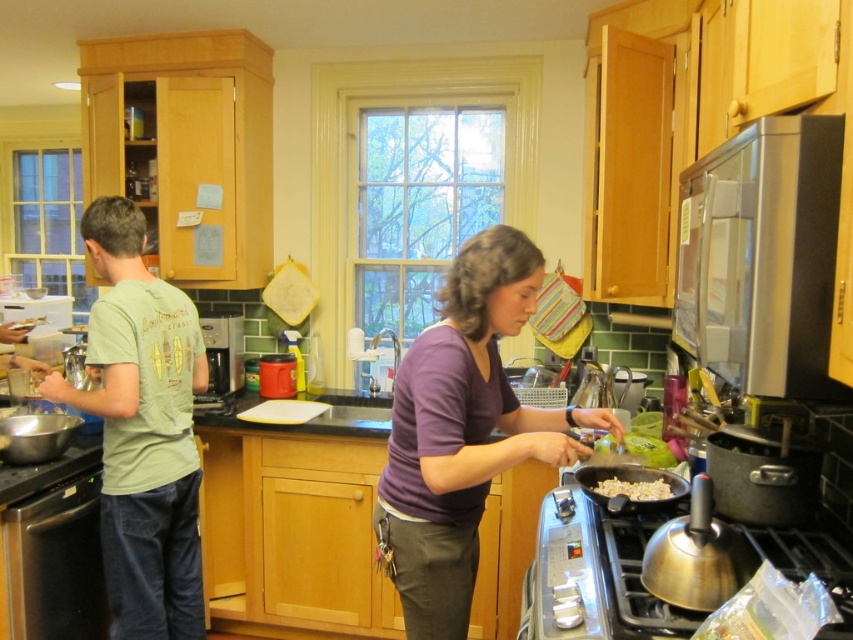
Does satin black dishwasher at lower left have a lesser width compared to brown matte pan at lower center?

Yes, satin black dishwasher at lower left is thinner than brown matte pan at lower center.

Does satin black dishwasher at lower left have a lesser height compared to brown matte pan at lower center?

In fact, satin black dishwasher at lower left may be taller than brown matte pan at lower center.

Does point (16, 621) come in front of point (627, 481)?

No, (16, 621) is further to viewer.

Locate an element on the screen. The image size is (853, 640). satin black dishwasher at lower left is located at coordinates (56, 563).

This screenshot has height=640, width=853. What do you see at coordinates (142, 429) in the screenshot?
I see `green cotton shirt at left` at bounding box center [142, 429].

Which is more to the right, green cotton shirt at left or brown matte pan at lower center?

brown matte pan at lower center is more to the right.

What do you see at coordinates (142, 429) in the screenshot? I see `green cotton shirt at left` at bounding box center [142, 429].

Locate an element on the screen. green cotton shirt at left is located at coordinates (142, 429).

Can you confirm if purple matte shirt at center is positioned to the right of brown matte pan at lower center?

No, purple matte shirt at center is not to the right of brown matte pan at lower center.

Does purple matte shirt at center have a lesser width compared to brown matte pan at lower center?

In fact, purple matte shirt at center might be wider than brown matte pan at lower center.

Which is in front, point (465, 296) or point (625, 481)?

Positioned in front is point (465, 296).

Where is `purple matte shirt at center`? Image resolution: width=853 pixels, height=640 pixels. purple matte shirt at center is located at coordinates (463, 432).